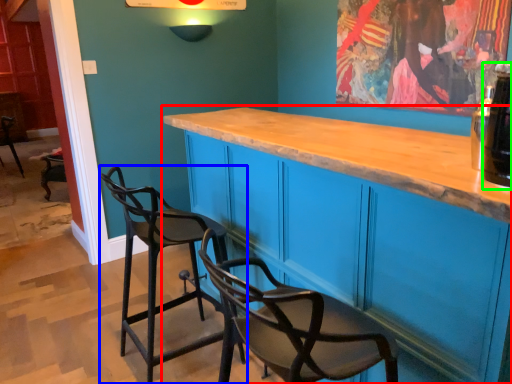
Question: Which is farther away from cabinetry (highlighted by a red box)? chair (highlighted by a blue box) or beverage (highlighted by a green box)?

Choices:
 (A) chair
 (B) beverage

Answer: (B)